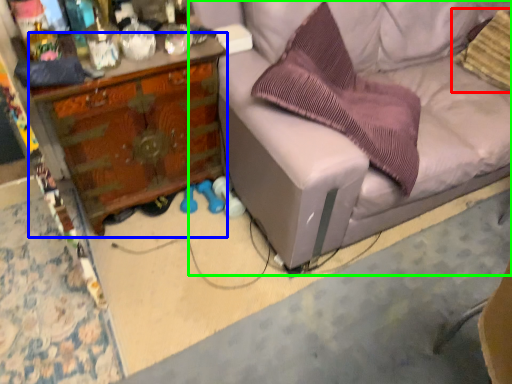
Question: Based on their relative distances, which object is nearer to pillow (highlighted by a red box)? Choose from desk (highlighted by a blue box) and studio couch (highlighted by a green box).

Choices:
 (A) desk
 (B) studio couch

Answer: (B)